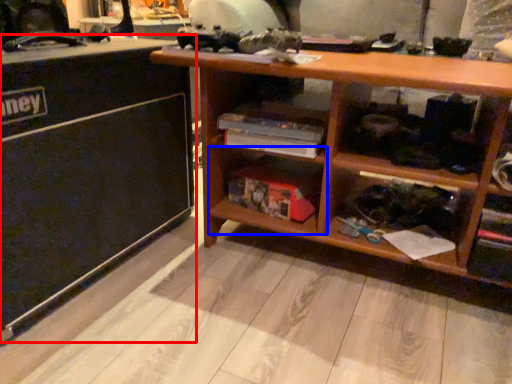
Question: Which object appears closest to the camera in this image, table (highlighted by a red box) or shelf (highlighted by a blue box)?

Choices:
 (A) table
 (B) shelf

Answer: (A)